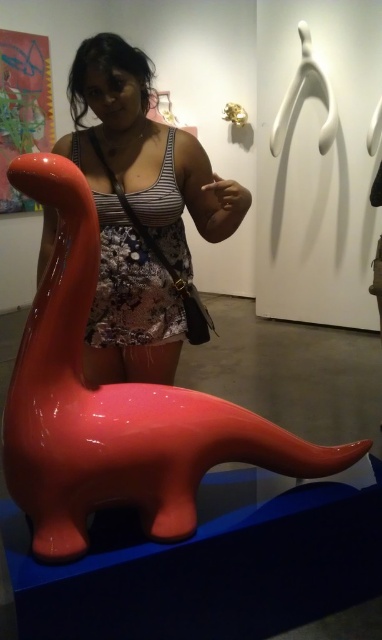
Question: Does glossy plastic dinosaur at lower left appear on the left side of matte black tank top at center?

Choices:
 (A) yes
 (B) no

Answer: (B)

Question: Which object is farther from the camera taking this photo?

Choices:
 (A) glossy plastic dinosaur at lower left
 (B) matte black tank top at center

Answer: (B)

Question: Which of the following is the farthest from the observer?

Choices:
 (A) (100, 422)
 (B) (118, 326)

Answer: (B)

Question: Does glossy plastic dinosaur at lower left have a larger size compared to matte black tank top at center?

Choices:
 (A) yes
 (B) no

Answer: (A)

Question: Can you confirm if glossy plastic dinosaur at lower left is bigger than matte black tank top at center?

Choices:
 (A) no
 (B) yes

Answer: (B)

Question: Which of the following is the closest to the observer?

Choices:
 (A) (289, 444)
 (B) (199, 221)

Answer: (A)